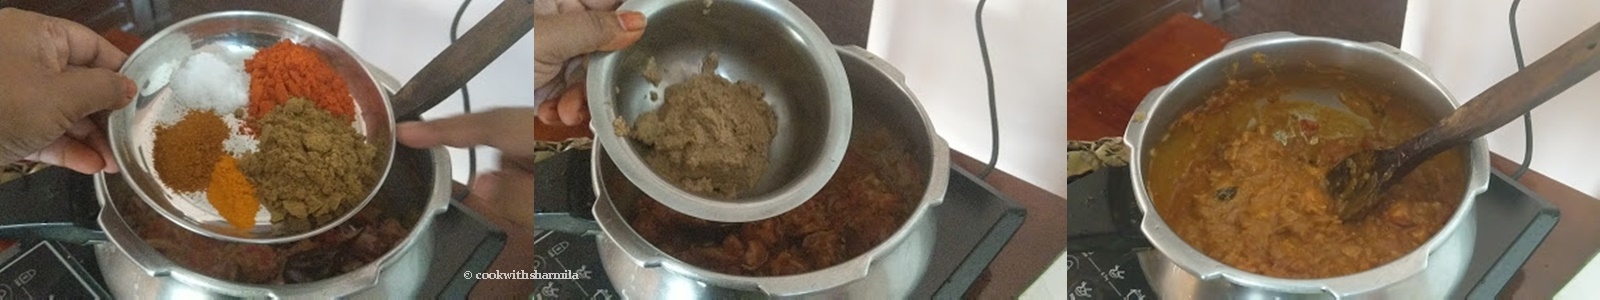
Locate an element on the screen. silver bowl is located at coordinates (221, 15).